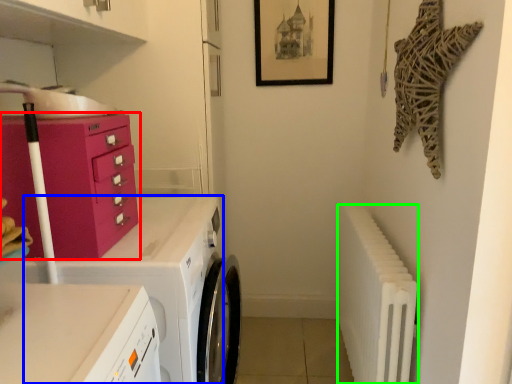
Question: Which is farther away from chest of drawers (highlighted by a red box)? home appliance (highlighted by a blue box) or radiator (highlighted by a green box)?

Choices:
 (A) home appliance
 (B) radiator

Answer: (B)